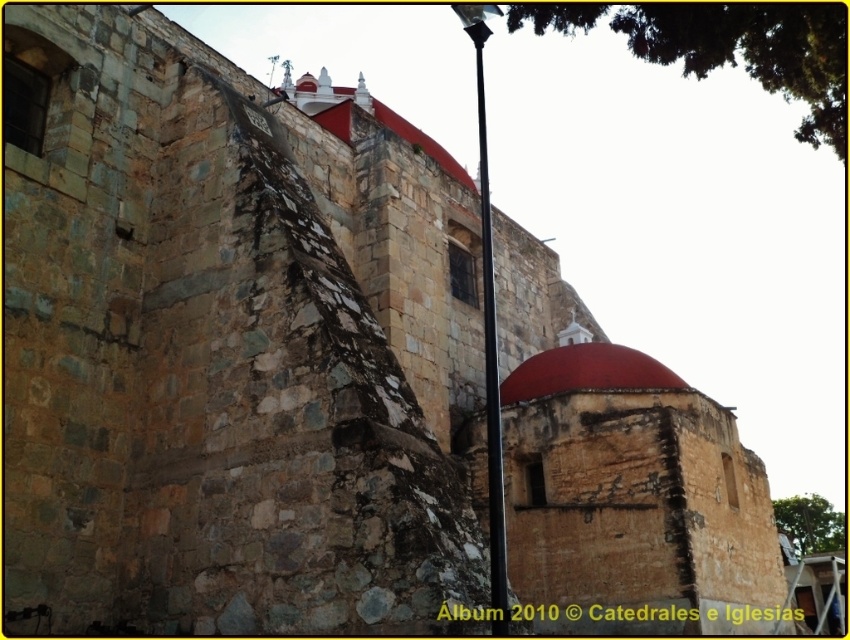
Consider the image. You are an architect examining the historic stone building. You notice two domes in the image. Which dome is closer to you, the smooth stone dome at center or the red stone dome at center?

The smooth stone dome at center is closer to you as it is positioned in front of the red stone dome at center.